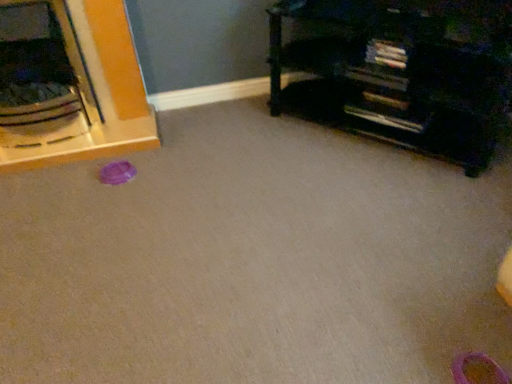
Image resolution: width=512 pixels, height=384 pixels. Identify the location of free point behind pink rubber shoe at lower right. (452, 319).